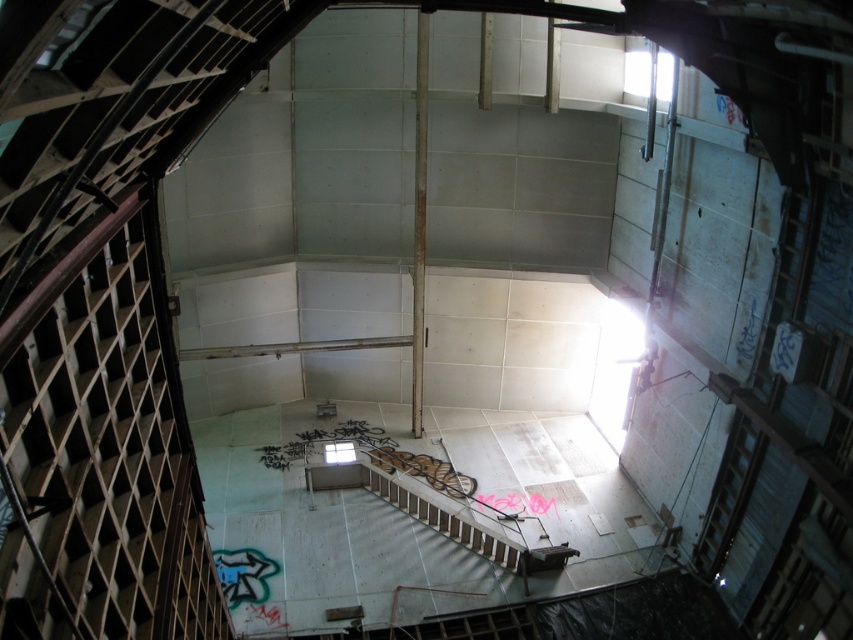
You are standing at the entrance of the abandoned industrial structure and see the wooden at left and the white concrete stairs at center. Which object is nearer to you?

The wooden at left is closer to the viewer than the white concrete stairs at center.

You are a painter who needs to reach a high spot on the wooden at left and the white concrete stairs at center. Which object allows you to stand on it to reach higher?

The wooden at left has a greater height compared to the white concrete stairs at center, so standing on the wooden at left would allow you to reach higher.

You are standing inside the abandoned industrial structure and notice two points marked on the ceiling. The first point is at coordinates point (50,412) and the second is at point (509,545). Which point is closer to you?

Point (50,412) is closer to the viewer than point (509,545).